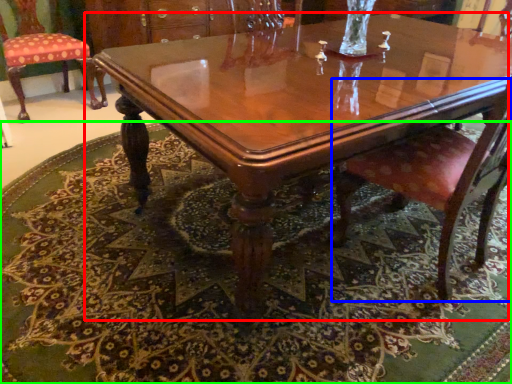
Question: Estimate the real-world distances between objects in this image. Which object is farther from coffee table (highlighted by a red box), chair (highlighted by a blue box) or mat (highlighted by a green box)?

Choices:
 (A) chair
 (B) mat

Answer: (B)